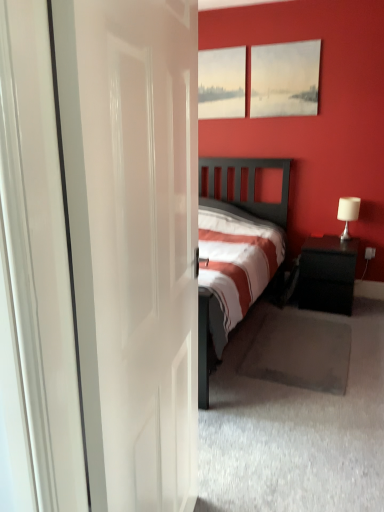
Question: Is white fabric lampshade at right wider or thinner than white glossy door at center?

Choices:
 (A) thin
 (B) wide

Answer: (B)

Question: From the image's perspective, is white fabric lampshade at right positioned above or below white glossy door at center?

Choices:
 (A) below
 (B) above

Answer: (B)

Question: Which object is the closest to the matte white painting at upper center?

Choices:
 (A) matte canvas painting at upper center
 (B) white glossy door at center
 (C) black glossy nightstand at right
 (D) white fabric lampshade at right

Answer: (A)

Question: Which object is the farthest from the matte canvas painting at upper center?

Choices:
 (A) white fabric lampshade at right
 (B) matte white painting at upper center
 (C) black glossy nightstand at right
 (D) white glossy door at center

Answer: (D)